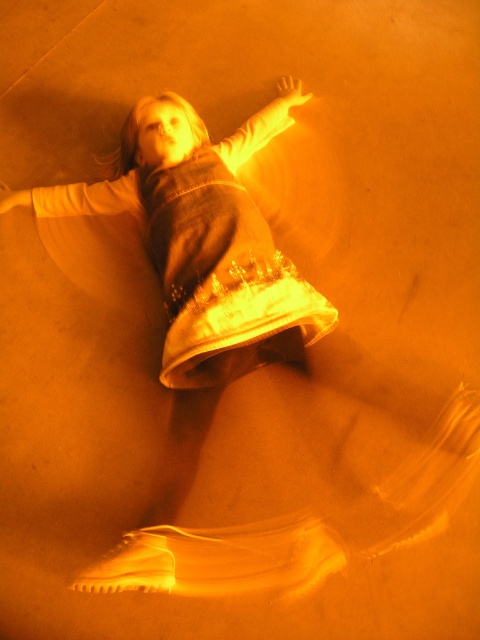
Question: Does white satin dress at center appear on the left side of matte yellow sleeve at upper left?

Choices:
 (A) no
 (B) yes

Answer: (A)

Question: Which of these objects is positioned farthest from the matte white arm at upper center?

Choices:
 (A) white satin dress at center
 (B) matte yellow sleeve at upper left

Answer: (B)

Question: Can you confirm if white satin dress at center is thinner than matte yellow sleeve at upper left?

Choices:
 (A) yes
 (B) no

Answer: (B)

Question: Does white satin dress at center have a larger size compared to matte yellow sleeve at upper left?

Choices:
 (A) yes
 (B) no

Answer: (A)

Question: Which point appears farthest from the camera in this image?

Choices:
 (A) (279, 109)
 (B) (14, 193)

Answer: (A)

Question: Among these objects, which one is nearest to the camera?

Choices:
 (A) matte yellow sleeve at upper left
 (B) white satin dress at center
 (C) matte white arm at upper center

Answer: (B)